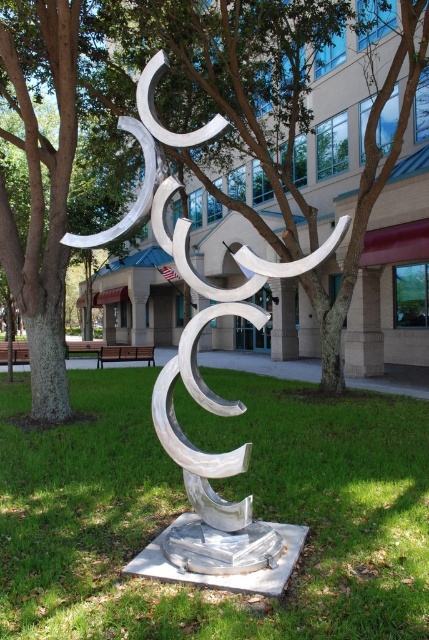
Consider the image. You are planning to take a photo of the green bark tree at center and the wooden park bench at lower left from a position where both are visible in the frame. Considering their heights, which object will appear taller in the photo?

The green bark tree at center will appear taller in the photo because it has a greater height compared to the wooden park bench at lower left.

You are standing at the base of the metallic sculpture and want to locate two points marked in the image. The first point is at coordinates point (154, 77) and the second is at point (102, 355). From your current position, which point is closer to you?

Point (154, 77) is in front of point (102, 355), so it is closer to you.

You are a gardener who needs to water both the green bark tree at center and the wooden park bench at lower left. The watering can you have can only hold enough water to cover 20 feet distance. Can you reach both objects without needing to refill your watering can?

The distance between the green bark tree at center and wooden park bench at lower left is 26.69 feet, which exceeds the 20 feet capacity of the watering can. Therefore, you will need to refill the watering can at least once to water both objects.